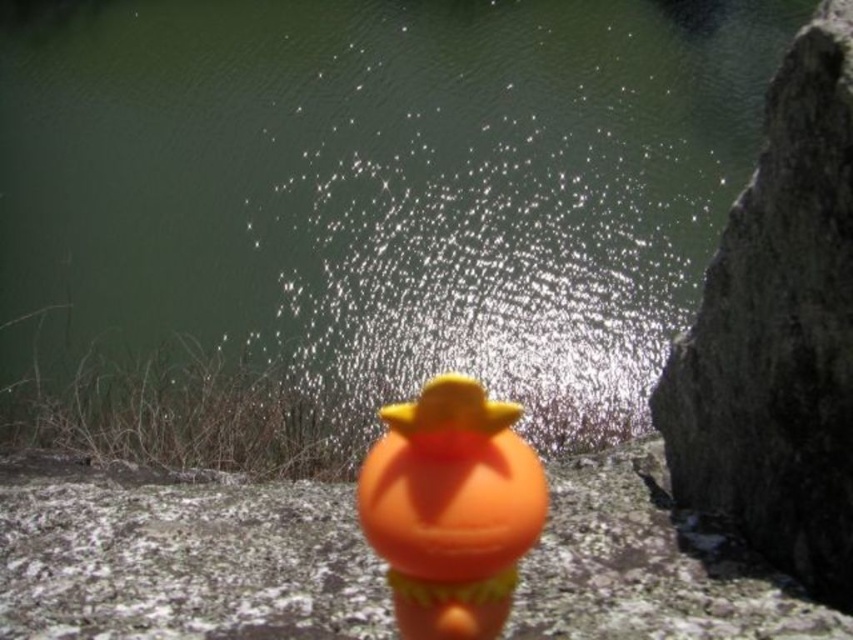
Which is in front, point (828, 310) or point (457, 477)?

Point (457, 477) is more forward.

Can you confirm if gray rough rock at right is shorter than orange matte rubber duck at center?

Incorrect, gray rough rock at right's height does not fall short of orange matte rubber duck at center's.

Who is more forward, (827, 576) or (498, 561)?

Point (498, 561)

Where is `gray rough rock at right`? gray rough rock at right is located at coordinates (779, 332).

Is green matte water at center shorter than gray rough rock at right?

In fact, green matte water at center may be taller than gray rough rock at right.

Is green matte water at center smaller than gray rough rock at right?

No, green matte water at center is not smaller than gray rough rock at right.

Based on the photo, who is more distant from viewer, (103, 308) or (773, 221)?

Point (103, 308)

Find the location of a particular element. green matte water at center is located at coordinates (358, 212).

Can you confirm if green matte water at center is bigger than orange matte rubber duck at center?

Yes.

Does green matte water at center appear on the right side of orange matte rubber duck at center?

In fact, green matte water at center is to the left of orange matte rubber duck at center.

Describe the element at coordinates (358, 212) in the screenshot. I see `green matte water at center` at that location.

At what (x,y) coordinates should I click in order to perform the action: click on green matte water at center. Please return your answer as a coordinate pair (x, y). Image resolution: width=853 pixels, height=640 pixels. Looking at the image, I should click on (358, 212).